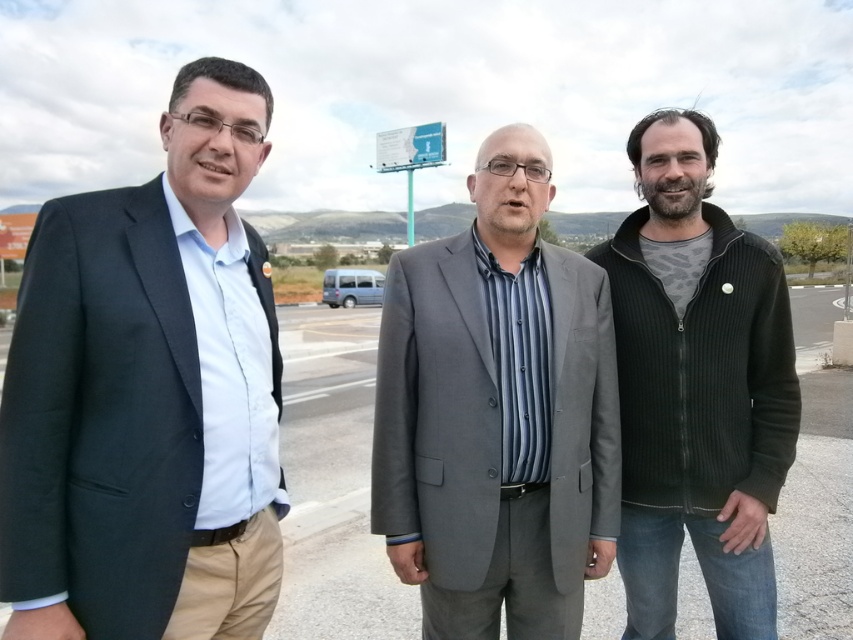
You are a photographer trying to capture a photo of the gray suit at center and the white plastic billboard at center. Based on their positions, which object is closer to the camera?

The gray suit at center is located below the white plastic billboard at center, so the gray suit at center is closer to the camera than the white plastic billboard at center.

You are a photographer setting up a shot of the matte black suit at left and the white plastic billboard at center. The billboard is part of the background. Based on their positions, which object is closer to the camera?

The matte black suit at left is closer to the camera because it is positioned below the white plastic billboard at center, indicating it is in the foreground.